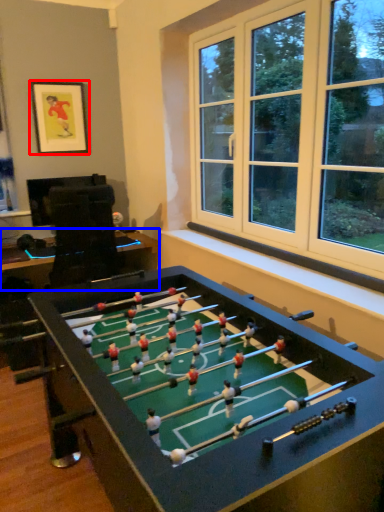
Question: Which point is further to the camera, picture frame (highlighted by a red box) or table (highlighted by a blue box)?

Choices:
 (A) picture frame
 (B) table

Answer: (A)